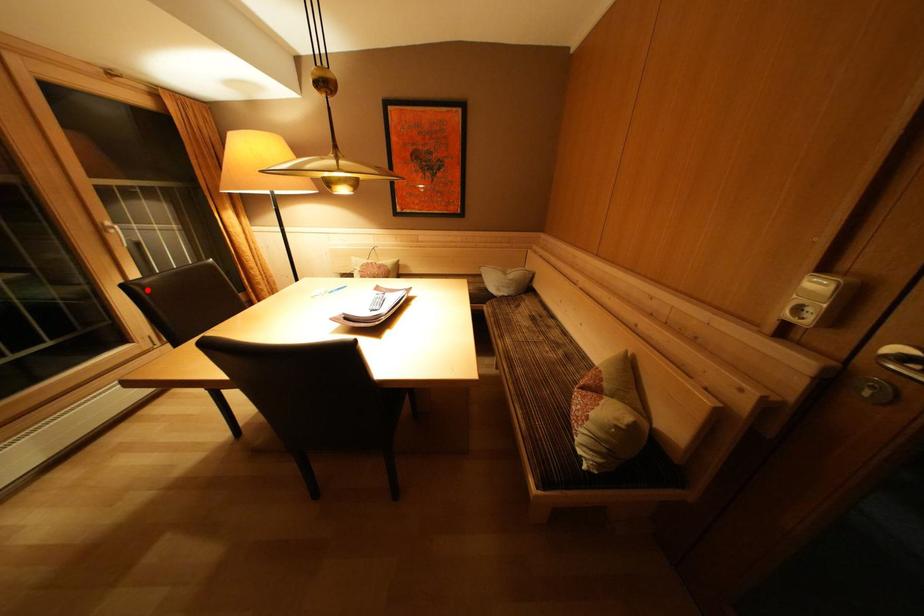
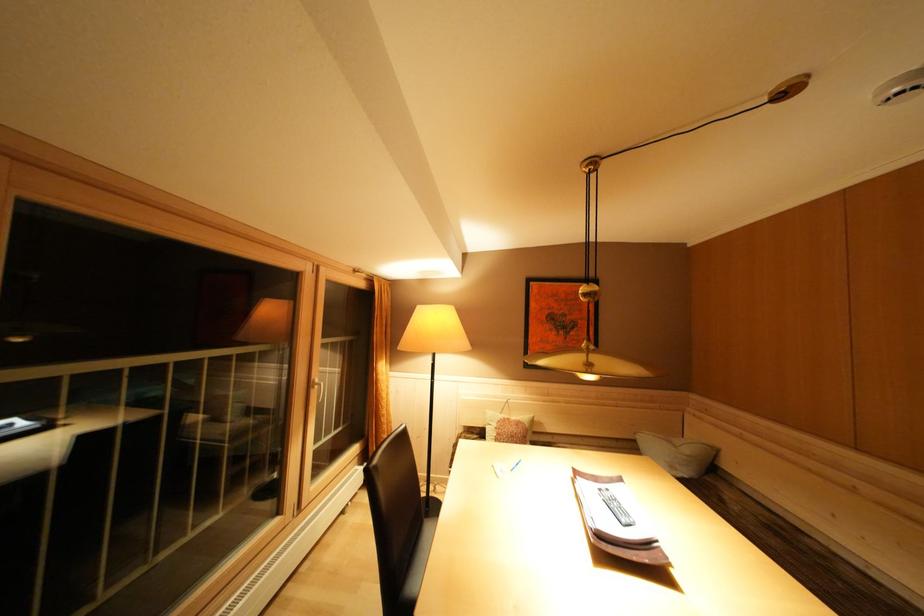
In the second image, find the point that corresponds to the highlighted location in the first image.

(383, 472)